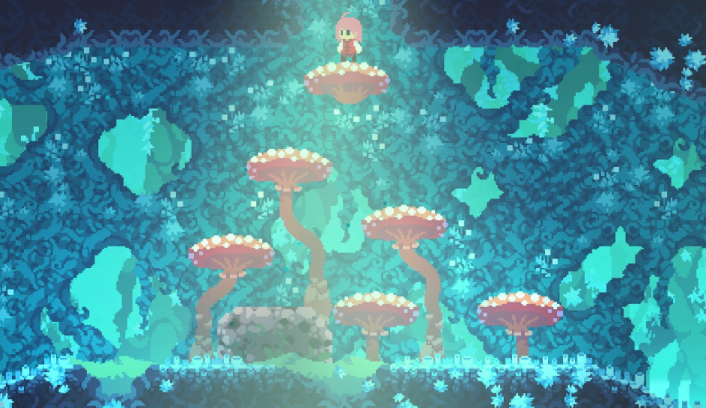
Find the location of `blue floor`. blue floor is located at coordinates (280, 393).